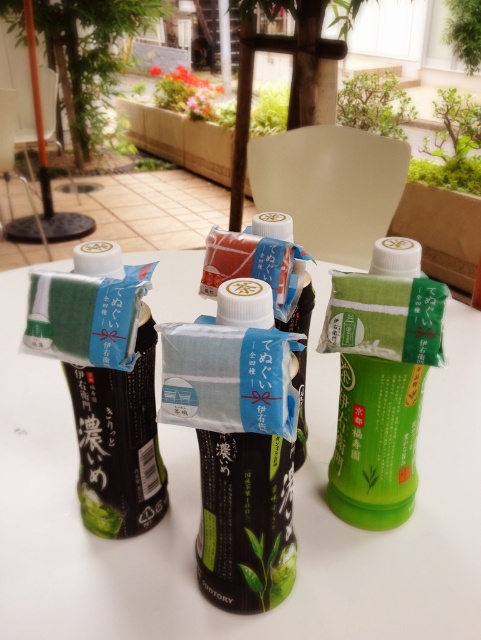
Who is positioned more to the right, green matte carton at center or matte black bottle at left?

green matte carton at center is more to the right.

Between point (334, 310) and point (101, 410), which one is positioned behind?

Point (101, 410)

The width and height of the screenshot is (481, 640). Describe the element at coordinates (380, 380) in the screenshot. I see `green matte carton at center` at that location.

Locate an element on the screen. green matte carton at center is located at coordinates (380, 380).

Is matte black bottle at center below matte black bottle at left?

Indeed, matte black bottle at center is positioned under matte black bottle at left.

Is point (274, 538) closer to viewer compared to point (125, 397)?

Yes, it is.

Locate an element on the screen. This screenshot has width=481, height=640. matte black bottle at center is located at coordinates (245, 520).

Measure the distance from green matte plastic bottles at center to green matte carton at center.

17.16 centimeters

Can you confirm if green matte plastic bottles at center is positioned above green matte carton at center?

Correct, green matte plastic bottles at center is located above green matte carton at center.

Where is `green matte plastic bottles at center`? green matte plastic bottles at center is located at coordinates (199, 515).